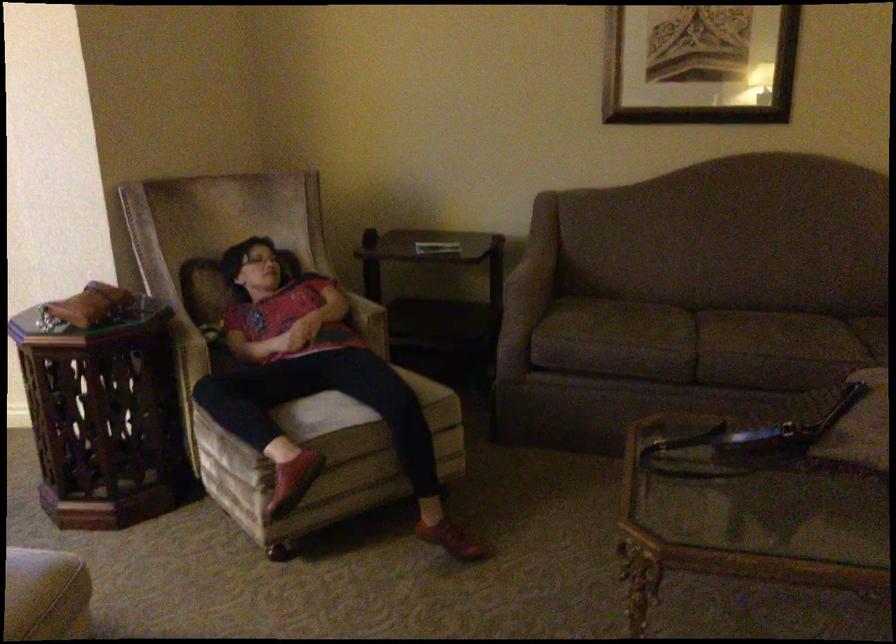
Where would you lift the brown leather purse? Please return your answer as a coordinate pair (x, y).

(90, 305)